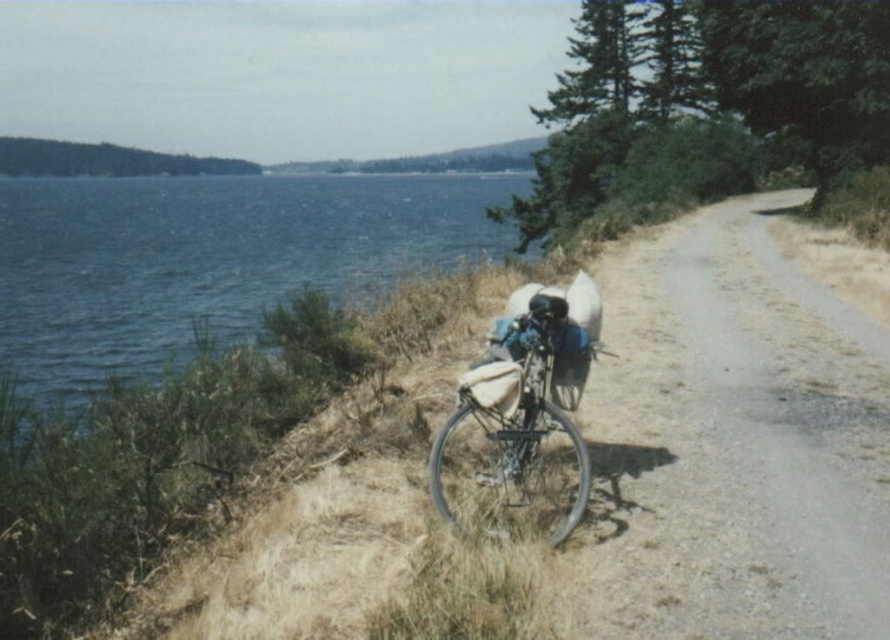
Does gravel road at center have a greater width compared to metallic silver bicycle at center?

Yes, gravel road at center is wider than metallic silver bicycle at center.

Is point (595, 456) in front of point (465, 406)?

That is False.

Locate an element on the screen. The image size is (890, 640). gravel road at center is located at coordinates (735, 444).

What do you see at coordinates (735, 444) in the screenshot? The width and height of the screenshot is (890, 640). I see `gravel road at center` at bounding box center [735, 444].

From the picture: Can you confirm if gravel road at center is thinner than blue water at left?

Indeed, gravel road at center has a lesser width compared to blue water at left.

Who is more distant from viewer, (886,483) or (279,260)?

Positioned behind is point (279,260).

The height and width of the screenshot is (640, 890). What are the coordinates of `gravel road at center` in the screenshot? It's located at (735, 444).

Between blue water at left and metallic silver bicycle at center, which one appears on the left side from the viewer's perspective?

From the viewer's perspective, blue water at left appears more on the left side.

Between point (2, 221) and point (541, 497), which one is positioned in front?

Point (541, 497) is in front.

Identify the location of blue water at left. The width and height of the screenshot is (890, 640). (209, 259).